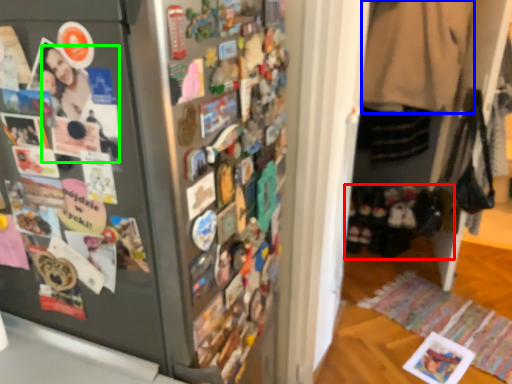
Question: Considering the real-world distances, which object is farthest from footwear (highlighted by a red box)? clothing (highlighted by a blue box) or person (highlighted by a green box)?

Choices:
 (A) clothing
 (B) person

Answer: (B)